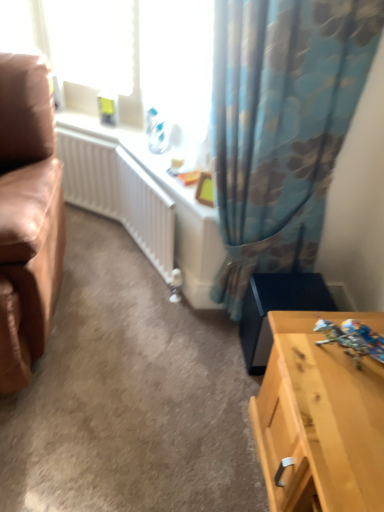
The image size is (384, 512). Identify the location of shiny metallic robot at lower right. (352, 339).

Locate an element on the screen. This screenshot has width=384, height=512. leather at left is located at coordinates (27, 216).

What do you see at coordinates (27, 216) in the screenshot?
I see `leather at left` at bounding box center [27, 216].

Locate an element on the screen. The width and height of the screenshot is (384, 512). shiny metallic robot at lower right is located at coordinates (352, 339).

Between light wood table at lower right and leather at left, which one has smaller width?

light wood table at lower right.

From the image's perspective, between light wood table at lower right and leather at left, which one is located above?

leather at left appears higher in the image.

Which is more to the right, light wood table at lower right or leather at left?

Positioned to the right is light wood table at lower right.

Considering the relative sizes of leather at left and light wood table at lower right in the image provided, is leather at left bigger than light wood table at lower right?

Indeed, leather at left has a larger size compared to light wood table at lower right.

I want to click on table behind the leather at left, so click(320, 418).

From the image's perspective, is leather at left above or below light wood table at lower right?

From the image's perspective, leather at left appears above light wood table at lower right.

How far apart are leather at left and light wood table at lower right?

They are 37.07 inches apart.

What's the angular difference between light wood table at lower right and floral fabric curtain at upper right's facing directions?

They differ by 88.4 degrees in their facing directions.

Consider the image. Is light wood table at lower right touching floral fabric curtain at upper right?

No, light wood table at lower right is not making contact with floral fabric curtain at upper right.

In the scene shown: Is light wood table at lower right in front of or behind floral fabric curtain at upper right in the image?

Visually, light wood table at lower right is located in front of floral fabric curtain at upper right.

Considering the relative sizes of light wood table at lower right and floral fabric curtain at upper right in the image provided, is light wood table at lower right taller than floral fabric curtain at upper right?

No.

Between white plastic window screen at upper left and light wood table at lower right, which one has smaller size?

white plastic window screen at upper left is smaller.

Is the position of white plastic window screen at upper left less distant than that of light wood table at lower right?

No, it is behind light wood table at lower right.

Where is `window screen that appears above the light wood table at lower right (from the image's perspective)`? The height and width of the screenshot is (512, 384). window screen that appears above the light wood table at lower right (from the image's perspective) is located at coordinates (77, 39).

Could you tell me if white plastic window screen at upper left is facing light wood table at lower right?

No, white plastic window screen at upper left does not turn towards light wood table at lower right.

Considering the positions of point (347, 96) and point (346, 392), is point (347, 96) closer or farther from the camera than point (346, 392)?

Point (347, 96) is positioned farther from the camera compared to point (346, 392).

Considering the sizes of floral fabric curtain at upper right and light wood table at lower right in the image, is floral fabric curtain at upper right taller or shorter than light wood table at lower right?

Considering their sizes, floral fabric curtain at upper right has more height than light wood table at lower right.

Would you say floral fabric curtain at upper right is a long distance from light wood table at lower right?

No, floral fabric curtain at upper right is in close proximity to light wood table at lower right.

From a real-world perspective, does floral fabric curtain at upper right stand above light wood table at lower right?

Yes, from a real-world perspective, floral fabric curtain at upper right is on top of light wood table at lower right.

Which of these two, white plastic window screen at upper left or leather at left, is wider?

leather at left.

Consider the image. Between white plastic window screen at upper left and leather at left, which one is positioned in front?

leather at left is more forward.

Is white plastic window screen at upper left far away from leather at left?

They are positioned close to each other.

How much distance is there between white plastic window screen at upper left and floral fabric curtain at upper right?

The distance of white plastic window screen at upper left from floral fabric curtain at upper right is 22.69 inches.

Is white plastic window screen at upper left far from floral fabric curtain at upper right?

They are positioned close to each other.

Is white plastic window screen at upper left shorter than floral fabric curtain at upper right?

Yes, white plastic window screen at upper left is shorter than floral fabric curtain at upper right.

Between white plastic window screen at upper left and floral fabric curtain at upper right, which one is positioned in front?

floral fabric curtain at upper right is closer to the camera.

Identify the location of studio couch lying above the light wood table at lower right (from the image's perspective). Image resolution: width=384 pixels, height=512 pixels. (27, 216).

At what (x,y) coordinates should I click in order to perform the action: click on studio couch above the light wood table at lower right (from a real-world perspective). Please return your answer as a coordinate pair (x, y). This screenshot has width=384, height=512. Looking at the image, I should click on (27, 216).

Considering their positions, is floral fabric curtain at upper right positioned closer to leather at left than shiny metallic robot at lower right?

Based on the image, floral fabric curtain at upper right appears to be nearer to leather at left.

From the image, which object appears to be farther from leather at left, light wood table at lower right or shiny metallic robot at lower right?

The object further to leather at left is shiny metallic robot at lower right.

Looking at the image, which one is located further to floral fabric curtain at upper right, white plastic window screen at upper left or light wood table at lower right?

Among the two, light wood table at lower right is located further to floral fabric curtain at upper right.

Considering their positions, is leather at left positioned closer to white plastic window screen at upper left than light wood table at lower right?

leather at left is positioned closer to the anchor white plastic window screen at upper left.

Estimate the real-world distances between objects in this image. Which object is closer to floral fabric curtain at upper right, white plastic window screen at upper left or leather at left?

white plastic window screen at upper left lies closer to floral fabric curtain at upper right than the other object.

From the image, which object appears to be nearer to floral fabric curtain at upper right, leather at left or shiny metallic robot at lower right?

shiny metallic robot at lower right lies closer to floral fabric curtain at upper right than the other object.

Considering their positions, is shiny metallic robot at lower right positioned closer to light wood table at lower right than white plastic window screen at upper left?

The object closer to light wood table at lower right is shiny metallic robot at lower right.

Based on their spatial positions, is shiny metallic robot at lower right or light wood table at lower right closer to floral fabric curtain at upper right?

Based on the image, light wood table at lower right appears to be nearer to floral fabric curtain at upper right.

The height and width of the screenshot is (512, 384). What are the coordinates of `toy that lies between white plastic window screen at upper left and light wood table at lower right from top to bottom` in the screenshot? It's located at (352, 339).

Find the location of `curtain located between leather at left and white plastic window screen at upper left in the depth direction`. curtain located between leather at left and white plastic window screen at upper left in the depth direction is located at coordinates (281, 125).

You are a GUI agent. You are given a task and a screenshot of the screen. Output one action in this format:
    pyautogui.click(x=<x>, y=<y>)
    Task: Click on the curtain that lies between white plastic window screen at upper left and light wood table at lower right from top to bottom
    This screenshot has height=512, width=384.
    Given the screenshot: What is the action you would take?
    pyautogui.click(x=281, y=125)

Find the location of a particular element. curtain between white plastic window screen at upper left and shiny metallic robot at lower right vertically is located at coordinates (281, 125).